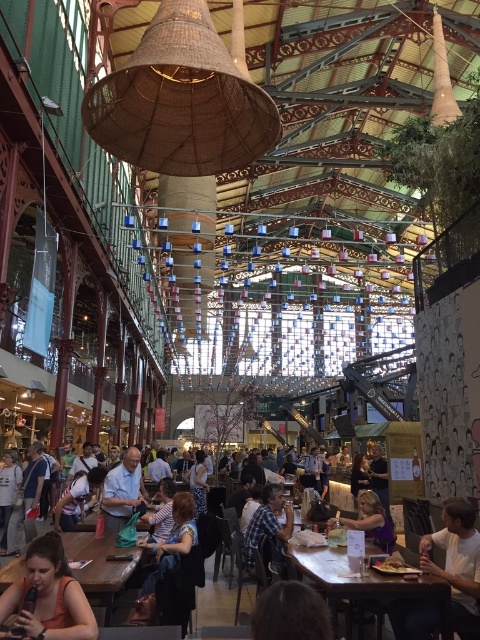
You are a photographer at the market and want to take a photo of both the plaid shirt at center and the light blue shirt at center. Which shirt should you focus on first if you want to capture them from left to right order?

The light blue shirt at center should be focused on first since the plaid shirt at center is positioned to its right.